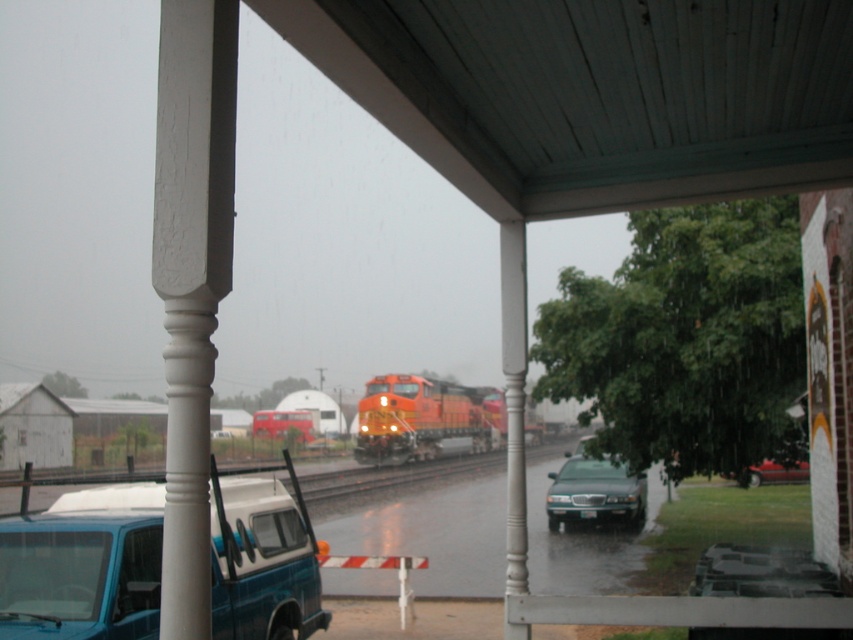
You are a photographer trying to capture both the orange glossy locomotive at center and the green matte sedan at center in a single frame. Which object should you focus on first to ensure both are in the frame?

The orange glossy locomotive at center is bigger than the green matte sedan at center, so you should focus on the orange glossy locomotive at center first to ensure both fit within the frame.

Looking at this image, you are a pedestrian standing on the sidewalk near the porch. You see the orange glossy locomotive at center and the metallic red car at lower right. Which object is closer to you?

The orange glossy locomotive at center is closer to you because it is positioned under the metallic red car at lower right, indicating it is in a lower spatial plane.